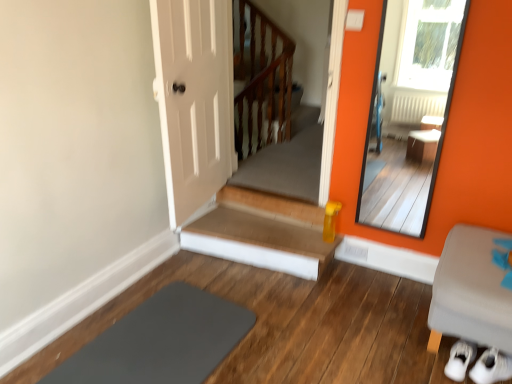
Identify the location of vacant area that is in front of wooden stairs at center. (244, 319).